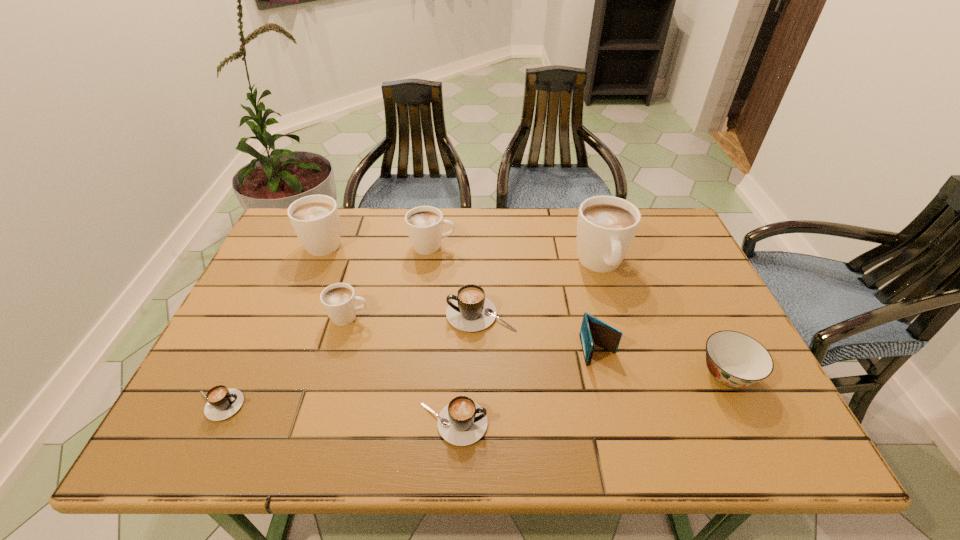
Where is `free space at the near edge of the desktop`? free space at the near edge of the desktop is located at coordinates (331, 418).

Locate an element on the screen. The width and height of the screenshot is (960, 540). blank space at the left edge is located at coordinates (249, 408).

Find the location of a particular element. vacant region at the right edge of the desktop is located at coordinates (693, 306).

Locate an element on the screen. The height and width of the screenshot is (540, 960). vacant point located between the biggest white cappuccino and the second smallest black cappuccino is located at coordinates (527, 344).

The height and width of the screenshot is (540, 960). What are the coordinates of `vacant point located between the second biggest black cappuccino and the biggest black cappuccino` in the screenshot? It's located at (467, 369).

This screenshot has width=960, height=540. Identify the location of free space that is in between the third biggest white cappuccino and the tallest object. (516, 255).

At what (x,y) coordinates should I click in order to perform the action: click on free spot between the rightmost object and the seventh object from right to left. Please return your answer as a coordinate pair (x, y). The image size is (960, 540). Looking at the image, I should click on (538, 346).

The width and height of the screenshot is (960, 540). I want to click on unoccupied area between the rightmost object and the second smallest white cappuccino, so click(580, 310).

Where is `free space that is in between the biggest black cappuccino and the blue wallet`? The height and width of the screenshot is (540, 960). free space that is in between the biggest black cappuccino and the blue wallet is located at coordinates (540, 332).

I want to click on vacant space that is in between the soup bowl and the fifth cappuccino from right to left, so click(538, 346).